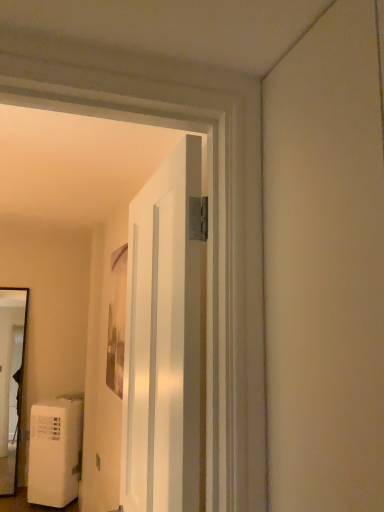
Question: Is matte wooden picture frame at center wider or thinner than white glossy door at center?

Choices:
 (A) wide
 (B) thin

Answer: (B)

Question: From their relative heights in the image, would you say matte wooden picture frame at center is taller or shorter than white glossy door at center?

Choices:
 (A) short
 (B) tall

Answer: (A)

Question: Which of these objects is positioned closest to the white glossy door at center?

Choices:
 (A) white matte water heater at lower left
 (B) matte wooden picture frame at center

Answer: (B)

Question: Which object is the closest to the white matte water heater at lower left?

Choices:
 (A) matte wooden picture frame at center
 (B) white glossy door at center

Answer: (A)